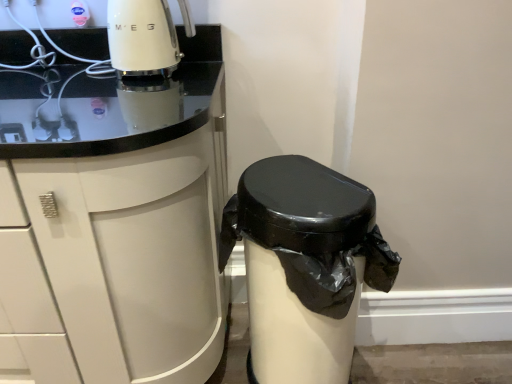
Question: Is black plastic waste bin at lower right at the left side of white glossy cabinet at upper left?

Choices:
 (A) yes
 (B) no

Answer: (B)

Question: Is white glossy cabinet at upper left completely or partially inside black plastic waste bin at lower right?

Choices:
 (A) yes
 (B) no

Answer: (B)

Question: Is black plastic waste bin at lower right far away from white glossy cabinet at upper left?

Choices:
 (A) yes
 (B) no

Answer: (B)

Question: Is black plastic waste bin at lower right at the right side of white glossy cabinet at upper left?

Choices:
 (A) yes
 (B) no

Answer: (A)

Question: Can we say black plastic waste bin at lower right lies outside white glossy cabinet at upper left?

Choices:
 (A) no
 (B) yes

Answer: (B)

Question: Is black plastic waste bin at lower right aimed at white glossy cabinet at upper left?

Choices:
 (A) no
 (B) yes

Answer: (A)

Question: Is the surface of white glossy cabinet at upper left in direct contact with black plastic waste bin at lower right?

Choices:
 (A) no
 (B) yes

Answer: (A)

Question: Is white glossy cabinet at upper left to the left of black plastic waste bin at lower right from the viewer's perspective?

Choices:
 (A) yes
 (B) no

Answer: (A)

Question: Is white glossy cabinet at upper left not near black plastic waste bin at lower right?

Choices:
 (A) no
 (B) yes

Answer: (A)

Question: Considering the relative sizes of white glossy cabinet at upper left and black plastic waste bin at lower right in the image provided, is white glossy cabinet at upper left bigger than black plastic waste bin at lower right?

Choices:
 (A) no
 (B) yes

Answer: (B)

Question: From the image's perspective, is white glossy cabinet at upper left located beneath black plastic waste bin at lower right?

Choices:
 (A) yes
 (B) no

Answer: (B)

Question: Is white glossy cabinet at upper left completely or partially outside of black plastic waste bin at lower right?

Choices:
 (A) yes
 (B) no

Answer: (A)

Question: Which is correct: white glossy cabinet at upper left is inside black plastic waste bin at lower right, or outside of it?

Choices:
 (A) inside
 (B) outside

Answer: (B)